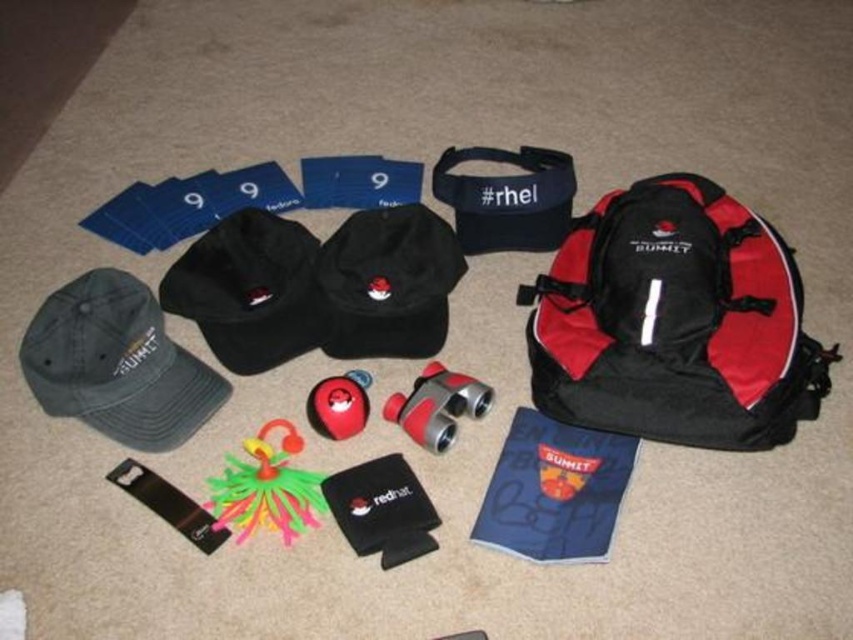
Question: Which point appears farthest from the camera in this image?

Choices:
 (A) (244, 474)
 (B) (711, 380)

Answer: (A)

Question: Can you confirm if black fabric baseball cap at upper left is positioned above rubber/soft toy at center?

Choices:
 (A) no
 (B) yes

Answer: (B)

Question: Which point is closer to the camera taking this photo?

Choices:
 (A) (361, 417)
 (B) (296, 346)

Answer: (A)

Question: Is dark gray fabric baseball cap at lower left smaller than rubber duck at center?

Choices:
 (A) no
 (B) yes

Answer: (A)

Question: Which is nearer to the red/black nylon backpack at center-right?

Choices:
 (A) black fabric baseball cap at center
 (B) rubber/soft toy at center
 (C) rubber duck at center

Answer: (A)

Question: Is rubber duck at center to the right of rubber/soft toy at center from the viewer's perspective?

Choices:
 (A) no
 (B) yes

Answer: (A)